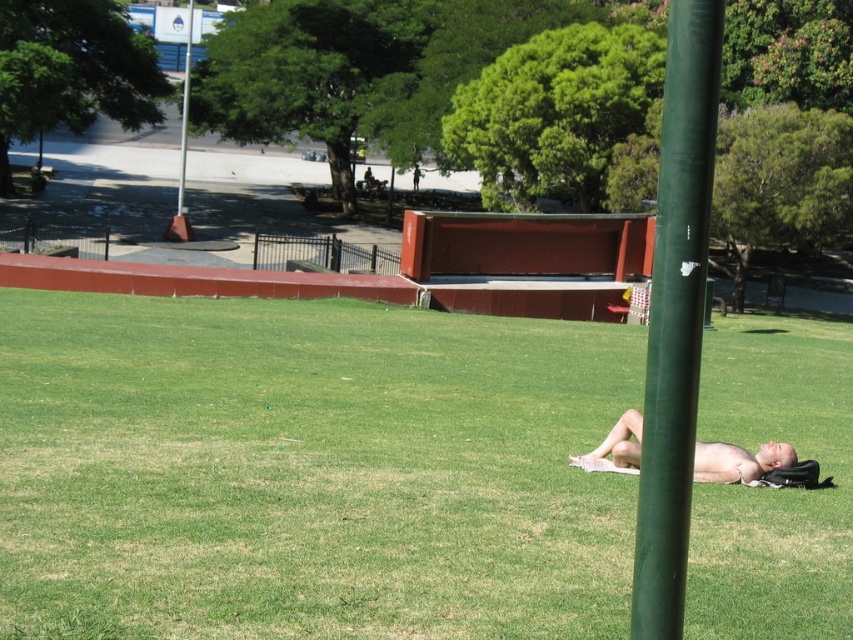
Identify the location of green matte pole at center. This screenshot has width=853, height=640. (675, 316).

Measure the distance between green matte pole at center and nude skin at lower right.

They are 24.00 feet apart.

The width and height of the screenshot is (853, 640). Describe the element at coordinates (675, 316) in the screenshot. I see `green matte pole at center` at that location.

Where is `green matte pole at center`? This screenshot has height=640, width=853. green matte pole at center is located at coordinates (675, 316).

Between green matte pole at center and green matte pole at upper center, which one is positioned lower?

green matte pole at center is below.

Does green matte pole at center appear over green matte pole at upper center?

No.

Between point (698, 353) and point (189, 33), which one is positioned behind?

Positioned behind is point (189, 33).

This screenshot has height=640, width=853. I want to click on green matte pole at center, so click(x=675, y=316).

Does nude skin at lower right appear on the left side of green matte pole at upper center?

No, nude skin at lower right is not to the left of green matte pole at upper center.

Who is more distant from viewer, [601,458] or [189,88]?

The point [189,88] is more distant.

Locate an element on the screen. This screenshot has width=853, height=640. nude skin at lower right is located at coordinates (738, 461).